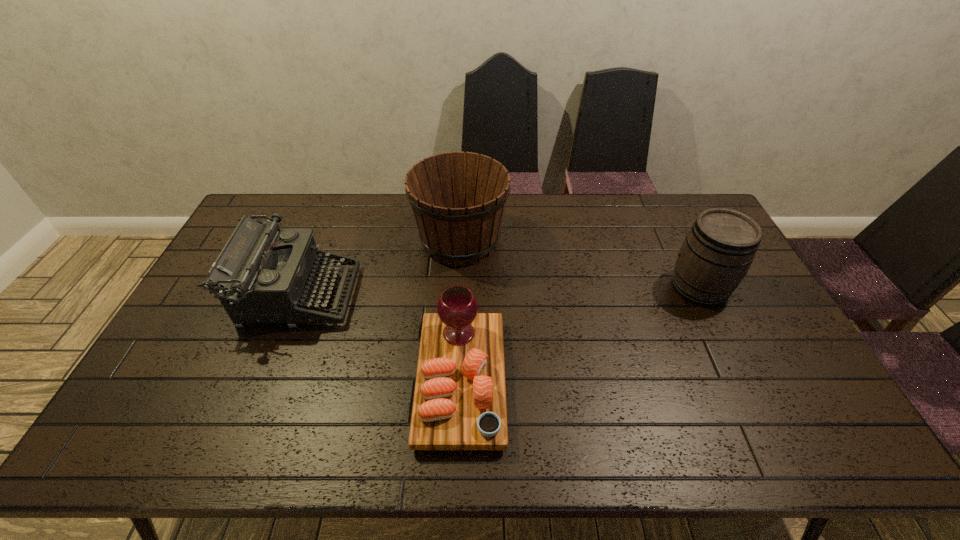
This screenshot has width=960, height=540. Find the location of `object at the left edge`. object at the left edge is located at coordinates (265, 276).

I want to click on object that is positioned at the right edge, so click(x=720, y=247).

In the image, there is a desktop. At what (x,y) coordinates should I click in order to perform the action: click on vacant area at the far edge. Please return your answer as a coordinate pair (x, y). Looking at the image, I should click on coord(318,200).

Image resolution: width=960 pixels, height=540 pixels. In order to click on free space at the left edge of the desktop in this screenshot , I will do `click(193, 318)`.

The image size is (960, 540). What are the coordinates of `free space at the right edge` in the screenshot? It's located at (813, 408).

The width and height of the screenshot is (960, 540). What are the coordinates of `empty location between the rightmost object and the left wine bucket` in the screenshot? It's located at coord(580,264).

You are a GUI agent. You are given a task and a screenshot of the screen. Output one action in this format:
    pyautogui.click(x=<x>, y=<y>)
    Task: Click on the free area in between the typewriter and the platter
    The image size is (960, 540).
    Given the screenshot: What is the action you would take?
    pyautogui.click(x=379, y=338)

Find the location of a particular element. The image size is (960, 540). free space between the left wine bucket and the typewriter is located at coordinates (379, 268).

You are a GUI agent. You are given a task and a screenshot of the screen. Output one action in this format:
    pyautogui.click(x=<x>, y=<y>)
    Task: Click on the free space between the platter and the rightmost object
    
    Given the screenshot: What is the action you would take?
    pyautogui.click(x=580, y=334)

At what (x,y) coordinates should I click in order to perform the action: click on vacant area between the rightmost object and the platter. Please return your answer as a coordinate pair (x, y). Looking at the image, I should click on (x=580, y=334).